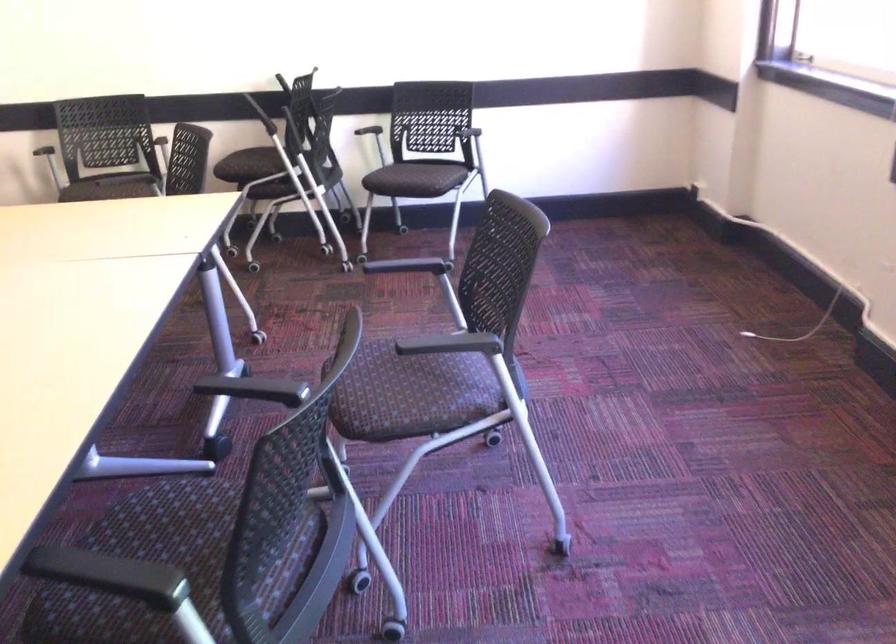
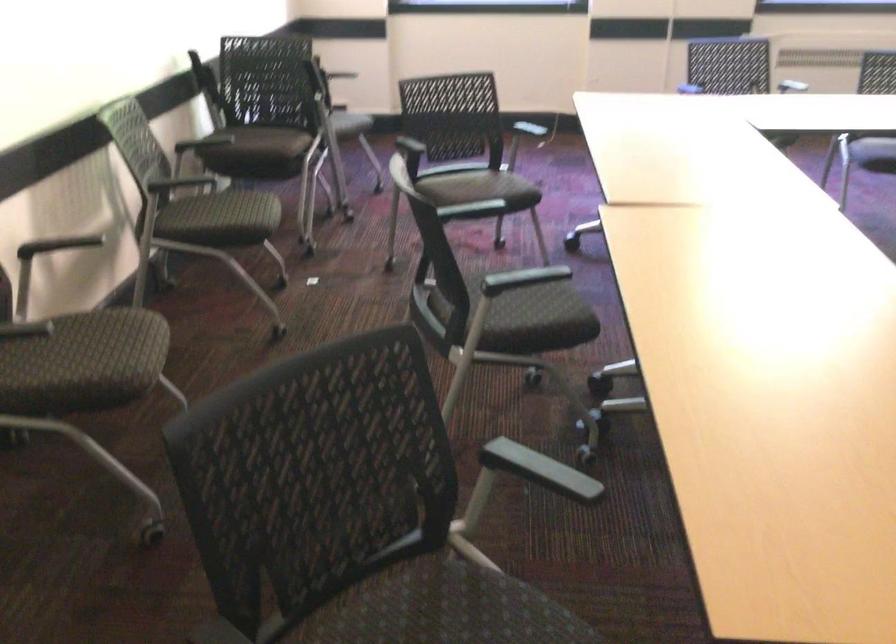
Where in the second image is the point corresponding to pixel 78 185 from the first image?

(250, 216)